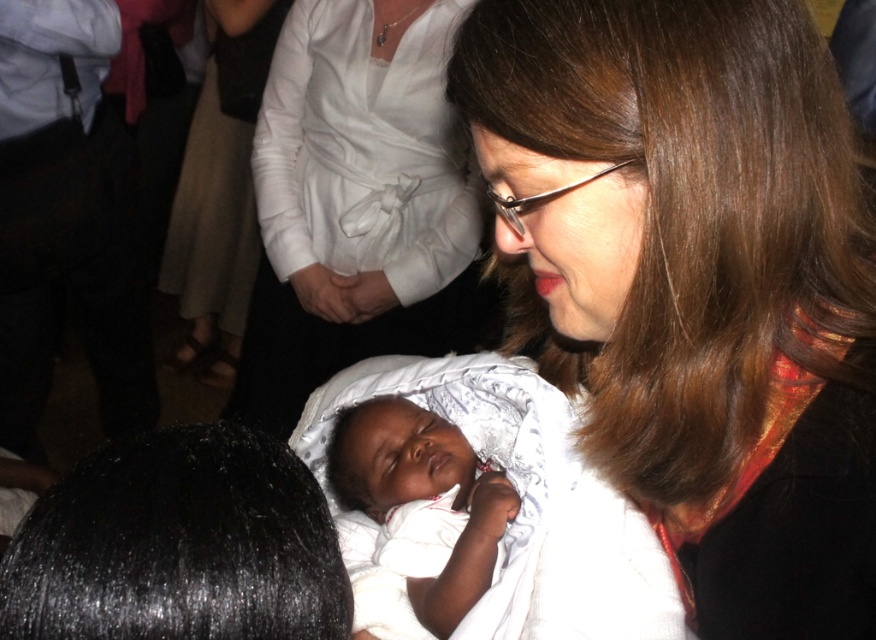
From the picture: Is smooth brown hair at center smaller than white satin dress at center?

Correct, smooth brown hair at center occupies less space than white satin dress at center.

Who is more distant from viewer, (661, 108) or (403, 88)?

The point (403, 88) is behind.

Who is more forward, (x=620, y=364) or (x=468, y=349)?

Point (x=620, y=364) is more forward.

At what (x,y) coordinates should I click in order to perform the action: click on smooth brown hair at center. Please return your answer as a coordinate pair (x, y). This screenshot has width=876, height=640. Looking at the image, I should click on (710, 289).

Who is higher up, white satin dress at center or white soft cloth at center?

white satin dress at center

Which is behind, point (400, 182) or point (438, 451)?

Point (400, 182)

I want to click on white satin dress at center, so click(x=358, y=202).

Where is `smooth brown hair at center`? The height and width of the screenshot is (640, 876). smooth brown hair at center is located at coordinates (710, 289).

From the picture: Who is higher up, smooth brown hair at center or white soft cloth at center?

Positioned higher is smooth brown hair at center.

Where is `smooth brown hair at center`? The width and height of the screenshot is (876, 640). smooth brown hair at center is located at coordinates (710, 289).

The image size is (876, 640). I want to click on smooth brown hair at center, so click(710, 289).